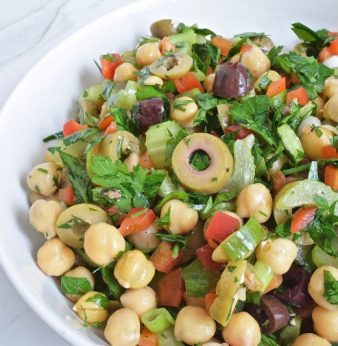
Where is `rim of plate`? The image size is (338, 346). rim of plate is located at coordinates (47, 316).